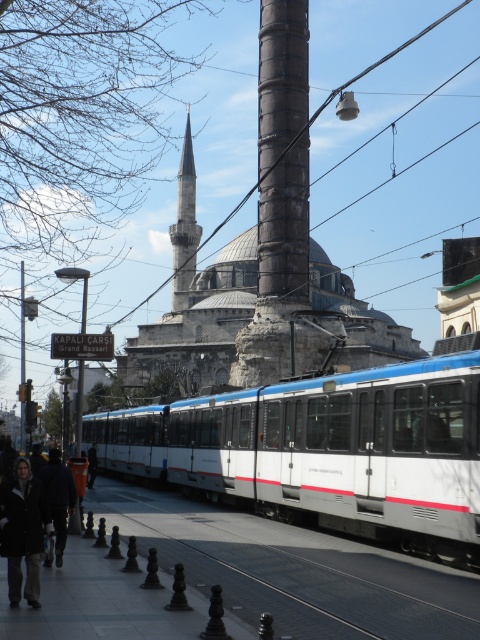
From the picture: You are a pedestrian standing at the dark gray jacket at lower left position. You want to cross the street to reach the tram stop located behind the white glossy train at center. The tram is moving towards you. If the tram is traveling at 15 km per hour, will you have enough time to safely cross the street before the tram arrives?

The white glossy train at center is 14.41 meters away from the dark gray jacket at lower left. Since the tram is moving at 15 km per hour, converting that speed to meters per second gives approximately 4.17 m per second. To cross the street, assuming an average walking speed of 1.4 m per second, the time needed to cross 14.41 meters would be around 10.3 seconds. The tram would take 14.41 meters divided by 4.17 m per second, which is approximately 3.46 seconds to reach the pedestrian. This means the tram is

You are a pedestrian standing at the corner of the street. You see a white glossy train at center and a dark gray jacket at lower left. Which object is located to the right of the other?

The white glossy train at center is positioned on the right side of dark gray jacket at lower left.